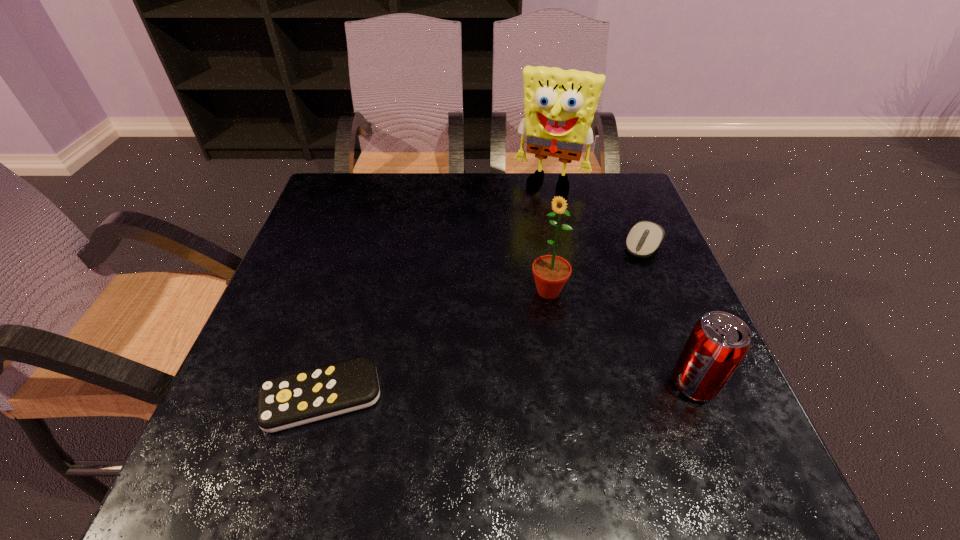
I want to click on the shortest object, so click(287, 401).

The width and height of the screenshot is (960, 540). I want to click on the leftmost object, so click(287, 401).

Where is `soda can`? soda can is located at coordinates (718, 342).

At what (x,y) coordinates should I click in order to perform the action: click on sunflower. Please return your answer as a coordinate pair (x, y). This screenshot has width=960, height=540. Looking at the image, I should click on (551, 272).

Where is `the third nearest object`? The width and height of the screenshot is (960, 540). the third nearest object is located at coordinates (551, 272).

Image resolution: width=960 pixels, height=540 pixels. Identify the location of the fourth nearest object. (644, 238).

Image resolution: width=960 pixels, height=540 pixels. What are the coordinates of `the fourth tallest object` in the screenshot? It's located at (644, 238).

Find the location of a particular element. sponge is located at coordinates (560, 104).

At what (x,y) coordinates should I click in order to perform the action: click on the farthest object. Please return your answer as a coordinate pair (x, y). This screenshot has height=540, width=960. Looking at the image, I should click on (560, 104).

Find the location of `free spot located 0.240m on the right of the remote control`. free spot located 0.240m on the right of the remote control is located at coordinates (517, 397).